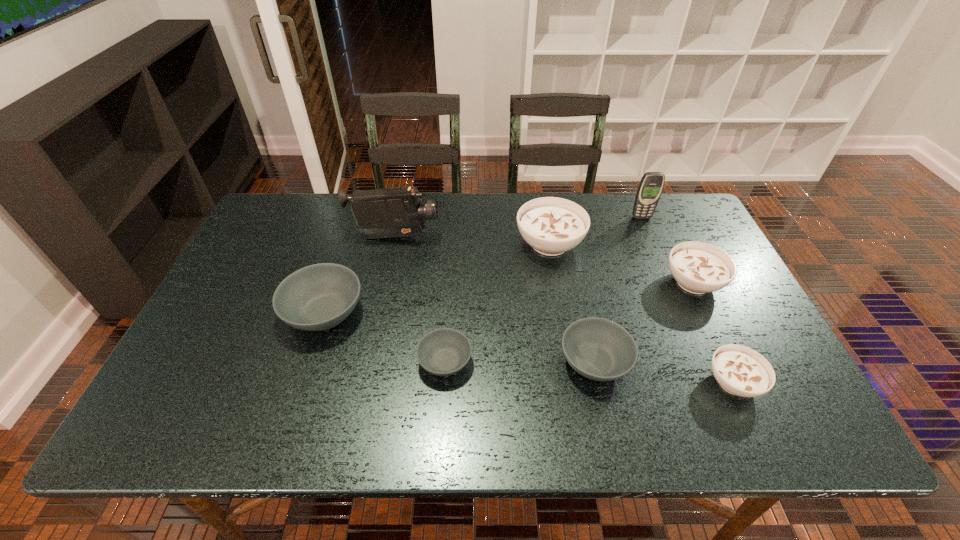
You are a GUI agent. You are given a task and a screenshot of the screen. Output one action in this format:
    pyautogui.click(x=<x>, y=<y>)
    Task: Click on the shortest object
    Image resolution: width=960 pixels, height=540 pixels.
    Given the screenshot: What is the action you would take?
    pyautogui.click(x=442, y=352)

Where is `the second gray soup bowl from right to left`? The width and height of the screenshot is (960, 540). the second gray soup bowl from right to left is located at coordinates (442, 352).

I want to click on vacant area situated 0.280m on the front-facing side of the black camcorder, so click(532, 237).

Where is `free space located 0.100m on the screen of the gray cellular telephone`? free space located 0.100m on the screen of the gray cellular telephone is located at coordinates (651, 239).

Identify the location of free space located 0.210m on the front of the biggest white soup bowl. The height and width of the screenshot is (540, 960). (564, 325).

At what (x,y) coordinates should I click in order to perform the action: click on vacant space located on the back of the leftmost gray soup bowl. Please return your answer as a coordinate pair (x, y). The image size is (960, 540). Looking at the image, I should click on (352, 227).

Where is `free location located on the back of the second biggest white soup bowl`? free location located on the back of the second biggest white soup bowl is located at coordinates (670, 233).

The width and height of the screenshot is (960, 540). I want to click on free space located on the back of the rightmost gray soup bowl, so click(576, 276).

Where is `free space located on the back of the smallest white soup bowl`? This screenshot has width=960, height=540. free space located on the back of the smallest white soup bowl is located at coordinates (674, 254).

Where is `blank space located on the back of the shortest object`? blank space located on the back of the shortest object is located at coordinates (451, 274).